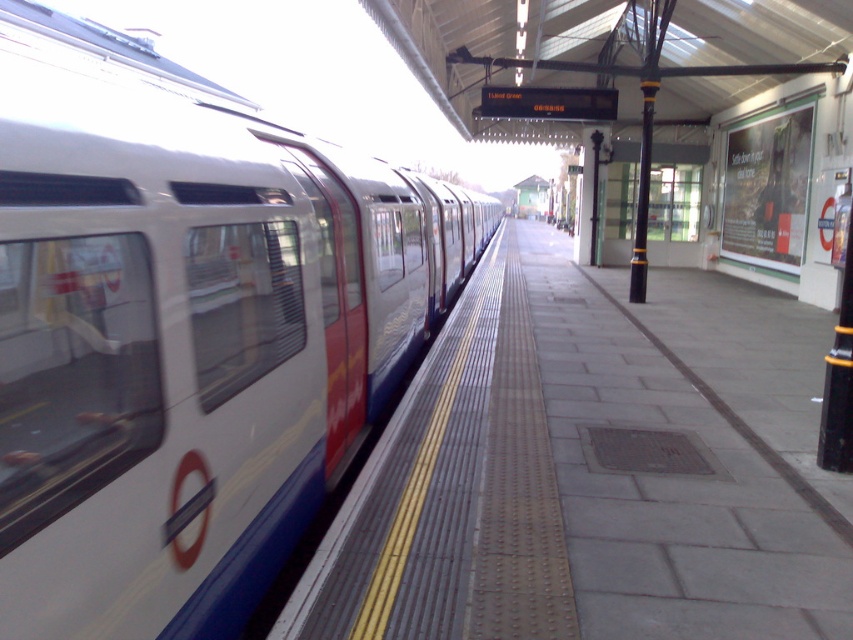
You are a photographer standing on the platform and want to take a photo of the white glossy train at left. If your camera is 1.6 meters long, will it fit between you and the train without any obstruction?

The distance between you and the white glossy train at left is 1.90 meters, which is greater than the camera length of 1.6 meters, so yes, the camera can fit between you and the train.

You are standing on the train station platform and see the white glossy train at left. Based on its position, where would you estimate the train is located relative to the platform?

The white glossy train at left is located at point (186,330) relative to the platform.

You are a maintenance worker needing to walk from one end of the platform to the other. Considering the white glossy train at left and the metallic gray platform at center, which one is wider and could potentially block your path?

The white glossy train at left is wider than the metallic gray platform at center, so it could potentially block your path.